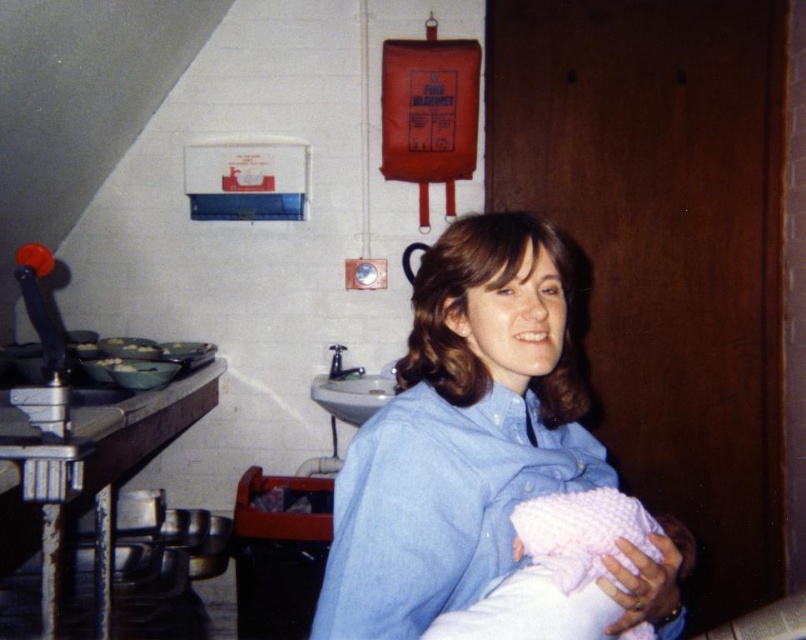
Is blue cotton shirt at center bigger than pink knitted blanket at lower center?

Yes, blue cotton shirt at center is bigger than pink knitted blanket at lower center.

I want to click on blue cotton shirt at center, so click(x=460, y=433).

Does point (568, 337) come behind point (638, 518)?

That is True.

This screenshot has height=640, width=806. In order to click on blue cotton shirt at center in this screenshot , I will do `click(460, 433)`.